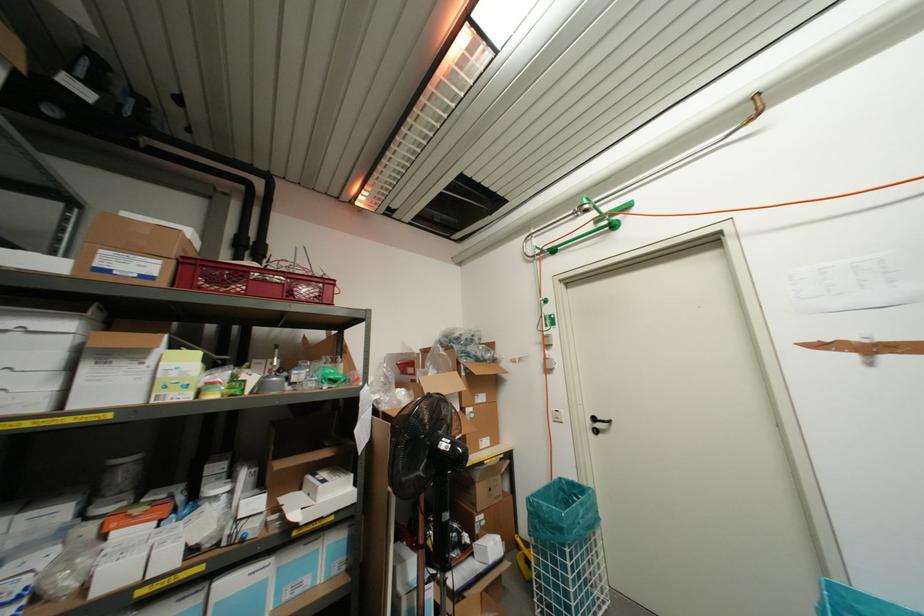
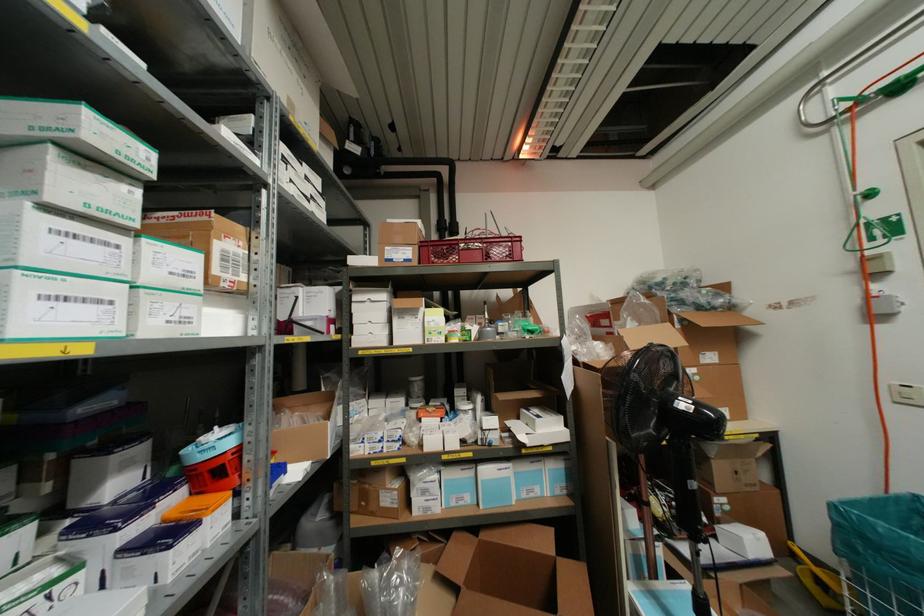
In the second image, find the point that corresponds to point (71, 368) in the first image.

(390, 321)